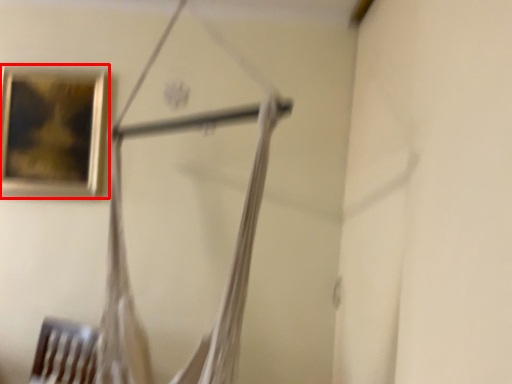
Question: From the image's perspective, where is picture frame (annotated by the red box) located in relation to hanger in the image?

Choices:
 (A) above
 (B) below

Answer: (A)